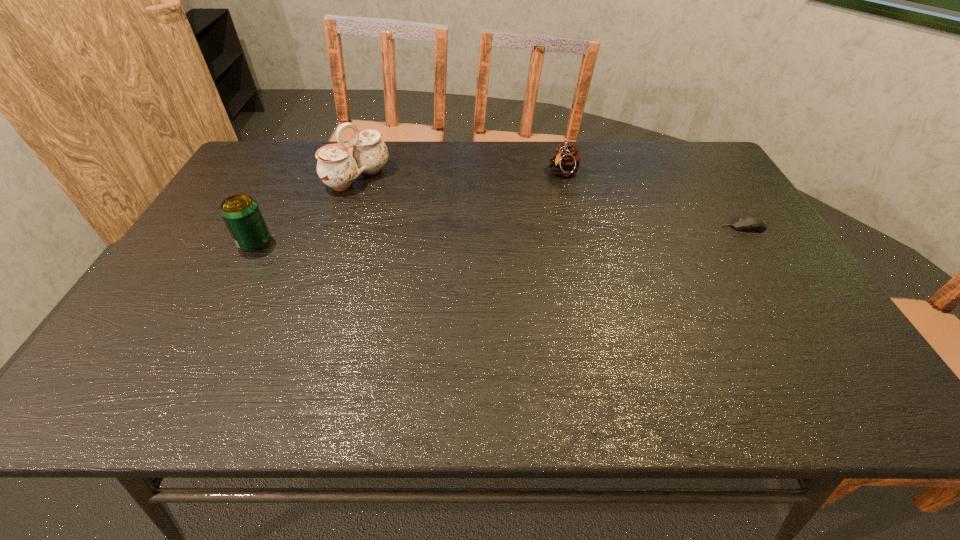
What are the coordinates of `free spot on the desktop that is between the beer can and the rightmost object and is positioned with a leaf charm attached to the pinecone` in the screenshot? It's located at (509, 234).

The height and width of the screenshot is (540, 960). I want to click on vacant spot on the desktop that is between the leftmost object and the rightmost object and is positioned by the handle of the tallest object, so click(x=453, y=236).